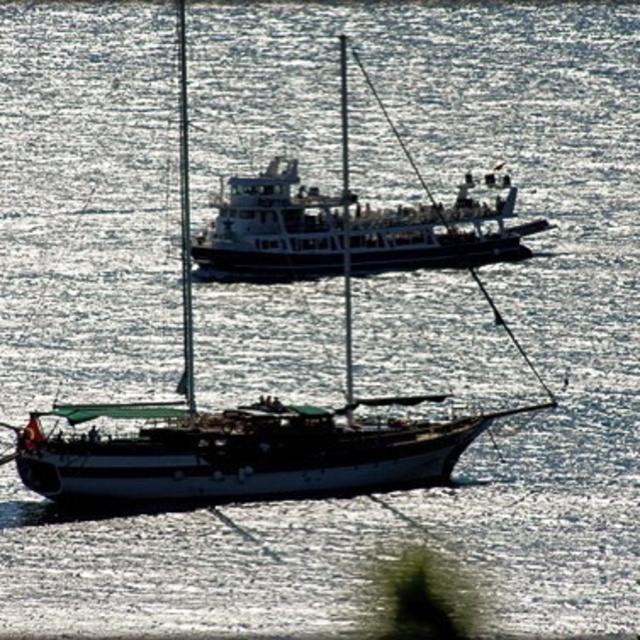
Question: Which point is closer to the camera taking this photo?

Choices:
 (A) (436, 244)
 (B) (262, 424)

Answer: (B)

Question: Considering the relative positions of white matte sailboat at lower center and white matte boat at center in the image provided, where is white matte sailboat at lower center located with respect to white matte boat at center?

Choices:
 (A) right
 (B) left

Answer: (B)

Question: Does white matte sailboat at lower center come behind white matte boat at center?

Choices:
 (A) no
 (B) yes

Answer: (A)

Question: Which point is closer to the camera?

Choices:
 (A) (273, 451)
 (B) (483, 248)

Answer: (A)

Question: Is white matte sailboat at lower center positioned at the back of white matte boat at center?

Choices:
 (A) yes
 (B) no

Answer: (B)

Question: Which object is closer to the camera taking this photo?

Choices:
 (A) white matte sailboat at lower center
 (B) white matte boat at center

Answer: (A)